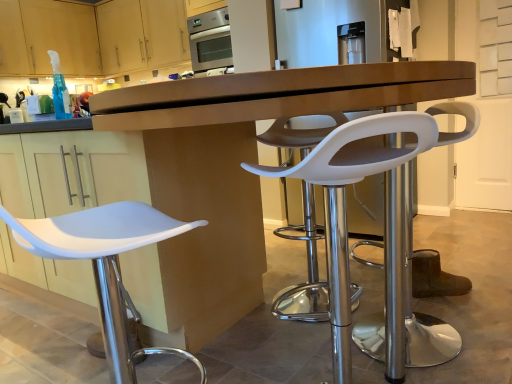
Question: Is matte wood cabinets at upper left, arranged as the 1th cabinetry when viewed from the right, looking in the opposite direction of matte wood cabinet at upper left, marked as the 2th cabinetry in a right-to-left arrangement?

Choices:
 (A) no
 (B) yes

Answer: (A)

Question: Does matte wood cabinets at upper left, placed as the 2th cabinetry when sorted from left to right, lie in front of matte wood cabinet at upper left, marked as the 2th cabinetry in a right-to-left arrangement?

Choices:
 (A) yes
 (B) no

Answer: (B)

Question: From the image's perspective, is matte wood cabinets at upper left, arranged as the 1th cabinetry when viewed from the right, located above matte wood cabinet at upper left, marked as the 2th cabinetry in a right-to-left arrangement?

Choices:
 (A) no
 (B) yes

Answer: (B)

Question: Can you confirm if matte wood cabinets at upper left, placed as the 2th cabinetry when sorted from left to right, is wider than matte wood cabinet at upper left, marked as the 2th cabinetry in a right-to-left arrangement?

Choices:
 (A) yes
 (B) no

Answer: (B)

Question: From a real-world perspective, is matte wood cabinets at upper left, placed as the 2th cabinetry when sorted from left to right, positioned over matte wood cabinet at upper left, the 1th cabinetry when ordered from left to right, based on gravity?

Choices:
 (A) yes
 (B) no

Answer: (B)

Question: Could you tell me if matte wood cabinets at upper left, arranged as the 1th cabinetry when viewed from the right, is turned towards matte wood cabinet at upper left, marked as the 2th cabinetry in a right-to-left arrangement?

Choices:
 (A) no
 (B) yes

Answer: (B)

Question: Does white plastic stool at left, which is counted as the first chair, starting from the left, have a larger size compared to matte brown desk at center?

Choices:
 (A) yes
 (B) no

Answer: (B)

Question: Does white plastic stool at left, which is counted as the first chair, starting from the left, have a greater height compared to matte brown desk at center?

Choices:
 (A) yes
 (B) no

Answer: (B)

Question: Is white plastic stool at left, placed as the 3th chair when sorted from right to left, at the right side of matte brown desk at center?

Choices:
 (A) no
 (B) yes

Answer: (A)

Question: Is white plastic stool at left, placed as the 3th chair when sorted from right to left, positioned behind matte brown desk at center?

Choices:
 (A) yes
 (B) no

Answer: (A)

Question: Considering the relative sizes of white plastic stool at left, placed as the 3th chair when sorted from right to left, and matte brown desk at center in the image provided, is white plastic stool at left, placed as the 3th chair when sorted from right to left, wider than matte brown desk at center?

Choices:
 (A) no
 (B) yes

Answer: (A)

Question: From the image's perspective, does white plastic stool at left, placed as the 3th chair when sorted from right to left, appear lower than matte brown desk at center?

Choices:
 (A) no
 (B) yes

Answer: (B)

Question: From the image's perspective, is white plastic stool at center, arranged as the second chair when viewed from the left, on matte wood cabinets at upper left, placed as the 2th cabinetry when sorted from left to right?

Choices:
 (A) yes
 (B) no

Answer: (B)